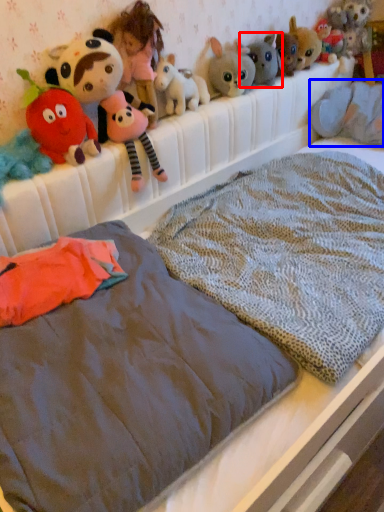
Question: Which object appears closest to the camera in this image, toy (highlighted by a red box) or animal (highlighted by a blue box)?

Choices:
 (A) toy
 (B) animal

Answer: (A)